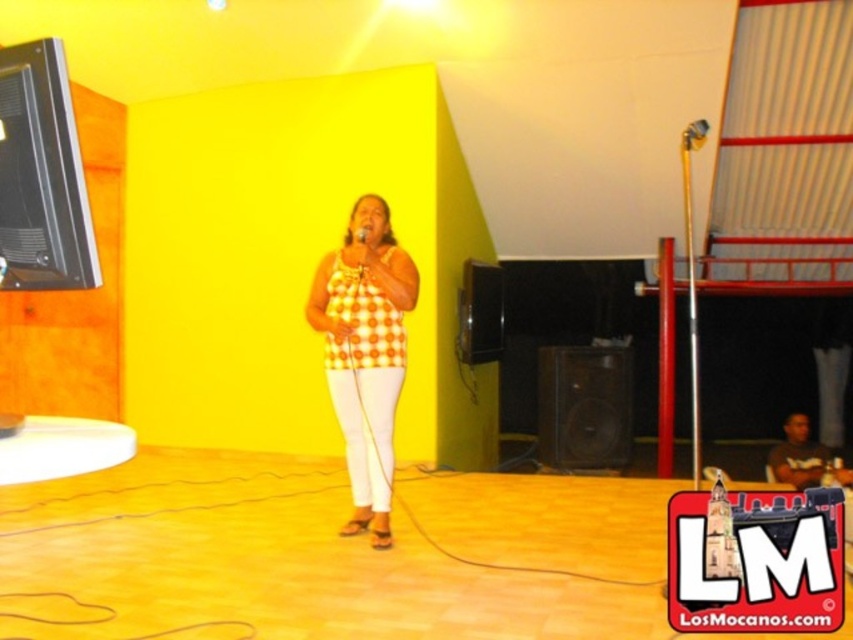
Question: Is yellow checkered tank top at center smaller than metallic shiny microphone at center?

Choices:
 (A) yes
 (B) no

Answer: (B)

Question: Is yellow checkered tank top at center bigger than metallic shiny microphone at center?

Choices:
 (A) no
 (B) yes

Answer: (B)

Question: Which object is farther from the camera taking this photo?

Choices:
 (A) metallic shiny microphone at center
 (B) yellow checkered tank top at center

Answer: (A)

Question: Can you confirm if yellow checkered tank top at center is positioned to the right of metallic shiny microphone at center?

Choices:
 (A) yes
 (B) no

Answer: (B)